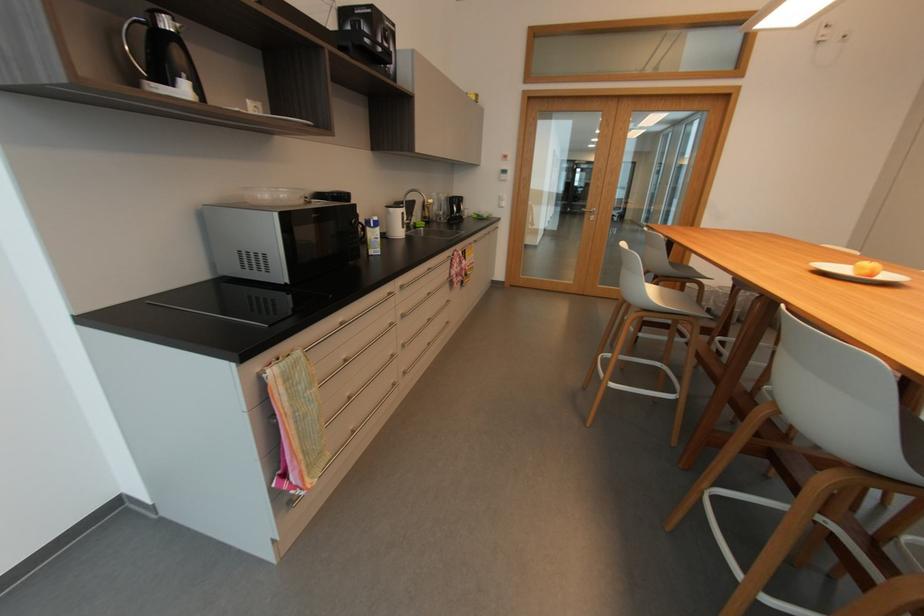
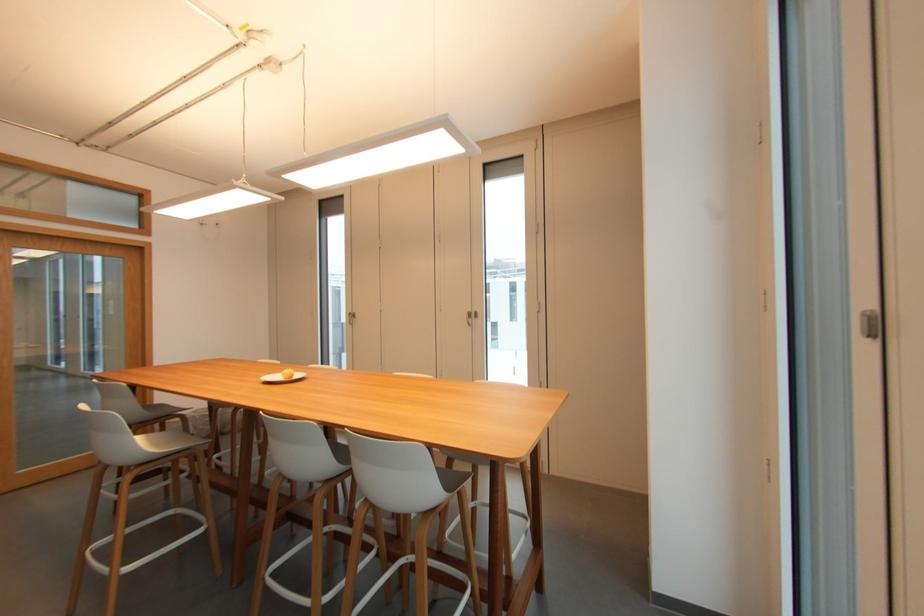
Locate, in the second image, the point that corresponds to point 874,274 in the first image.

(296, 377)